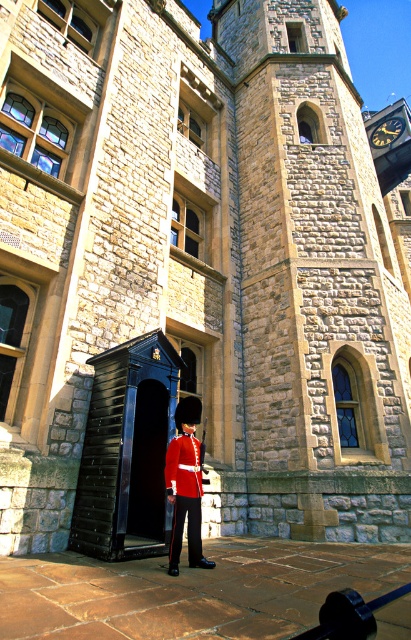
Which is behind, point (175, 449) or point (371, 145)?

Positioned behind is point (371, 145).

Is point (170, 566) positioned behind point (376, 147)?

No, (170, 566) is closer to viewer.

I want to click on shiny red uniform at center, so click(184, 497).

Can you confirm if black glossy door at center is wider than metallic clock at upper right?

Incorrect, black glossy door at center's width does not surpass metallic clock at upper right's.

Which is below, black glossy door at center or metallic clock at upper right?

black glossy door at center

The height and width of the screenshot is (640, 411). What do you see at coordinates (147, 464) in the screenshot?
I see `black glossy door at center` at bounding box center [147, 464].

Find the location of `black glossy door at center`. black glossy door at center is located at coordinates (147, 464).

Does point (159, 440) come behind point (175, 556)?

Yes, it is behind point (175, 556).

Which is more to the right, black glossy door at center or shiny red uniform at center?

shiny red uniform at center is more to the right.

Is point (150, 481) closer to camera compared to point (179, 486)?

No, it is behind (179, 486).

Locate an element on the screen. Image resolution: width=411 pixels, height=640 pixels. black glossy door at center is located at coordinates (147, 464).